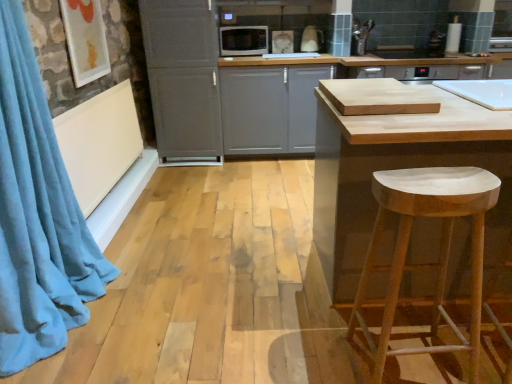
Where is `free area behind white matte stool at lower right`? free area behind white matte stool at lower right is located at coordinates (369, 323).